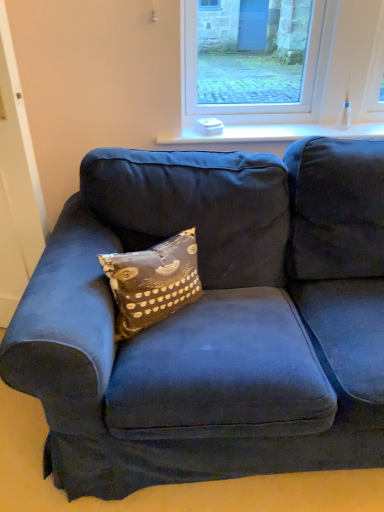
Question: Is brown printed cushion at center oriented towards white glossy window sill at upper center?

Choices:
 (A) yes
 (B) no

Answer: (B)

Question: Is brown printed cushion at center to the left of white glossy window sill at upper center from the viewer's perspective?

Choices:
 (A) yes
 (B) no

Answer: (A)

Question: Can you confirm if brown printed cushion at center is thinner than white glossy window sill at upper center?

Choices:
 (A) no
 (B) yes

Answer: (A)

Question: Is brown printed cushion at center in contact with white glossy window sill at upper center?

Choices:
 (A) yes
 (B) no

Answer: (B)

Question: Is brown printed cushion at center to the right of white glossy window sill at upper center from the viewer's perspective?

Choices:
 (A) no
 (B) yes

Answer: (A)

Question: From a real-world perspective, is brown printed cushion at center above or below white glossy window sill at upper center?

Choices:
 (A) above
 (B) below

Answer: (B)

Question: Considering the relative positions of brown printed cushion at center and white glossy window sill at upper center in the image provided, is brown printed cushion at center to the left or to the right of white glossy window sill at upper center?

Choices:
 (A) left
 (B) right

Answer: (A)

Question: Considering the positions of brown printed cushion at center and white glossy window sill at upper center in the image, is brown printed cushion at center taller or shorter than white glossy window sill at upper center?

Choices:
 (A) tall
 (B) short

Answer: (A)

Question: Is point [137, 261] closer or farther from the camera than point [261, 126]?

Choices:
 (A) farther
 (B) closer

Answer: (B)

Question: Visually, is brown printed cushion at center positioned to the left or to the right of clear glass window at upper center?

Choices:
 (A) right
 (B) left

Answer: (B)

Question: In terms of height, does brown printed cushion at center look taller or shorter compared to clear glass window at upper center?

Choices:
 (A) tall
 (B) short

Answer: (B)

Question: Considering the positions of point (162, 263) and point (299, 94), is point (162, 263) closer or farther from the camera than point (299, 94)?

Choices:
 (A) closer
 (B) farther

Answer: (A)

Question: Do you think brown printed cushion at center is within clear glass window at upper center, or outside of it?

Choices:
 (A) inside
 (B) outside

Answer: (B)

Question: From the image's perspective, is clear glass window at upper center located above or below brown printed cushion at center?

Choices:
 (A) above
 (B) below

Answer: (A)

Question: In terms of width, does clear glass window at upper center look wider or thinner when compared to brown printed cushion at center?

Choices:
 (A) thin
 (B) wide

Answer: (A)